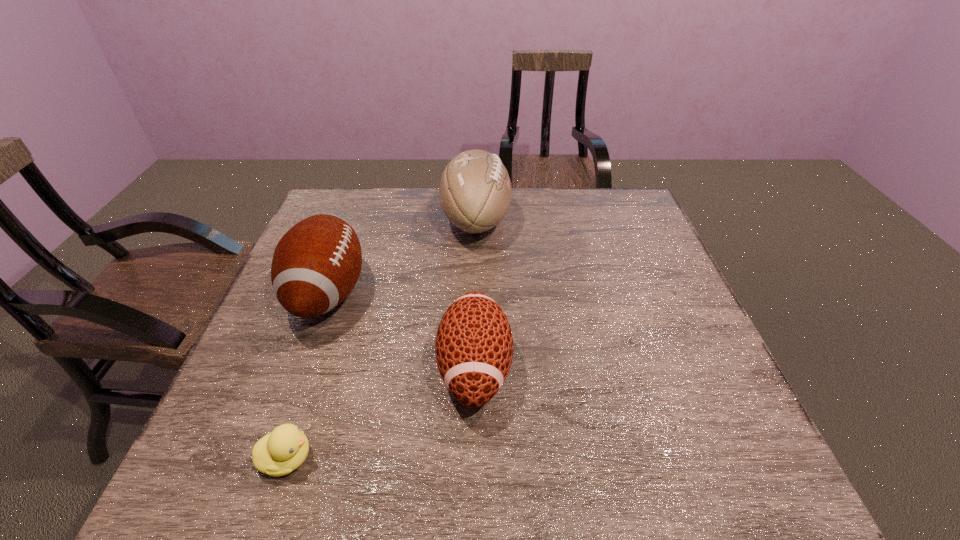
Find the location of a particular element. This screenshot has height=540, width=960. free spot between the shortest football and the nearest object is located at coordinates (381, 413).

I want to click on object that is the closest one to the shortest football, so click(316, 264).

Choose which object is the third nearest neighbor to the duckling. Please provide its 2D coordinates. Your answer should be formatted as a tuple, i.e. [(x, y)], where the tuple contains the x and y coordinates of a point satisfying the conditions above.

[(475, 190)]

This screenshot has width=960, height=540. I want to click on football that is the closest to the nearest object, so click(474, 344).

Where is `the closest football to the third tallest object`? This screenshot has width=960, height=540. the closest football to the third tallest object is located at coordinates (316, 264).

Locate an element on the screen. free space that satisfies the following two spatial constraints: 1. on the laces of the leftmost football; 2. on the back side of the shortest football is located at coordinates (300, 368).

The width and height of the screenshot is (960, 540). What are the coordinates of `vacant position in the image that satisfies the following two spatial constraints: 1. on the laces of the second shortest object; 2. on the right side of the leftmost football` in the screenshot? It's located at (300, 368).

The image size is (960, 540). What are the coordinates of `vacant point that satisfies the following two spatial constraints: 1. on the laces of the leftmost football; 2. on the back side of the shortest football` in the screenshot? It's located at coord(300,368).

The height and width of the screenshot is (540, 960). What are the coordinates of `vacant space that satisfies the following two spatial constraints: 1. on the laces of the leftmost football; 2. on the back side of the third tallest object` in the screenshot? It's located at tap(300, 368).

This screenshot has height=540, width=960. In order to click on vacant space that satisfies the following two spatial constraints: 1. on the laces of the leftmost football; 2. on the right side of the shortest football in this screenshot , I will do `click(300, 368)`.